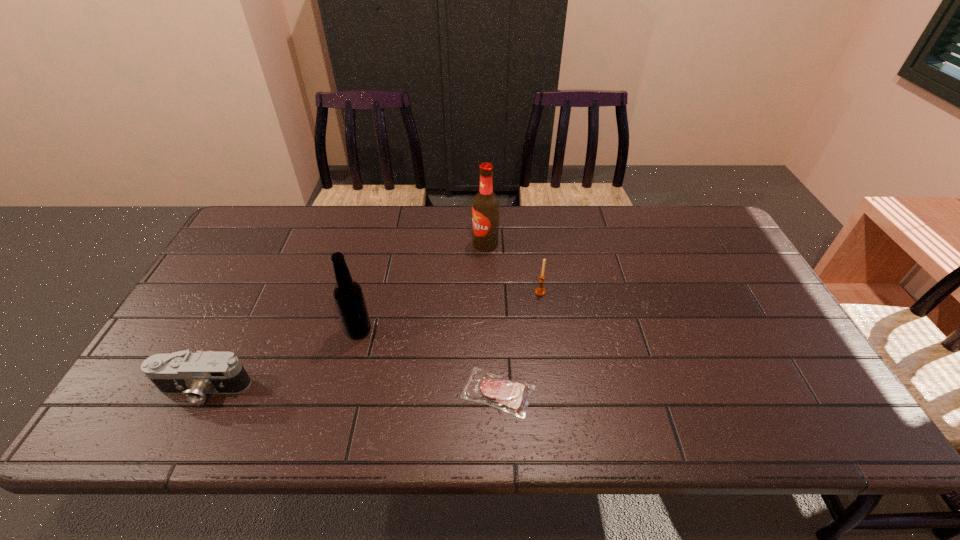
Identify the location of the farther beer bottle. Image resolution: width=960 pixels, height=540 pixels. (485, 206).

The height and width of the screenshot is (540, 960). Find the location of `the farthest object`. the farthest object is located at coordinates (485, 206).

What are the coordinates of `the nearer beer bottle` in the screenshot? It's located at (348, 295).

This screenshot has height=540, width=960. In order to click on the left beer bottle in this screenshot , I will do `click(348, 295)`.

Where is `the second farthest object`? the second farthest object is located at coordinates (540, 291).

You are a GUI agent. You are given a task and a screenshot of the screen. Output one action in this format:
    pyautogui.click(x=<x>, y=<y>)
    Task: Click on the candle_holder
    
    Given the screenshot: What is the action you would take?
    pyautogui.click(x=540, y=291)

In order to click on the leftmost object in this screenshot , I will do `click(192, 375)`.

At what (x,y) coordinates should I click in order to perform the action: click on camera. Please return your answer as a coordinate pair (x, y). Looking at the image, I should click on (192, 375).

In order to click on the shortest object in this screenshot , I will do `click(511, 396)`.

I want to click on vacant area situated on the left of the right beer bottle, so (x=457, y=244).